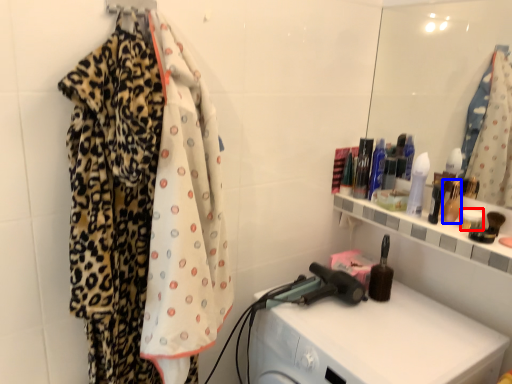
Question: Which of the following is the closest to the observer, toiletry (highlighted by a red box) or toiletry (highlighted by a blue box)?

Choices:
 (A) toiletry
 (B) toiletry

Answer: (A)